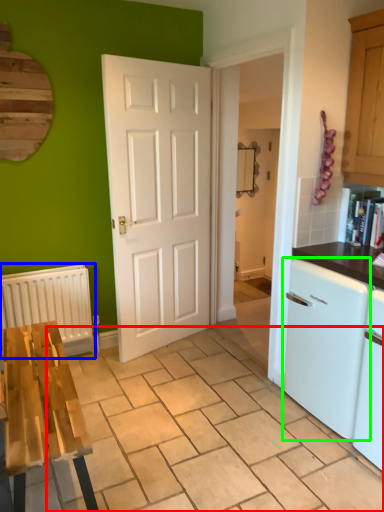
Question: Which is farther away from tile (highlighted by a red box)? radiator (highlighted by a blue box) or dish washer (highlighted by a green box)?

Choices:
 (A) radiator
 (B) dish washer

Answer: (A)